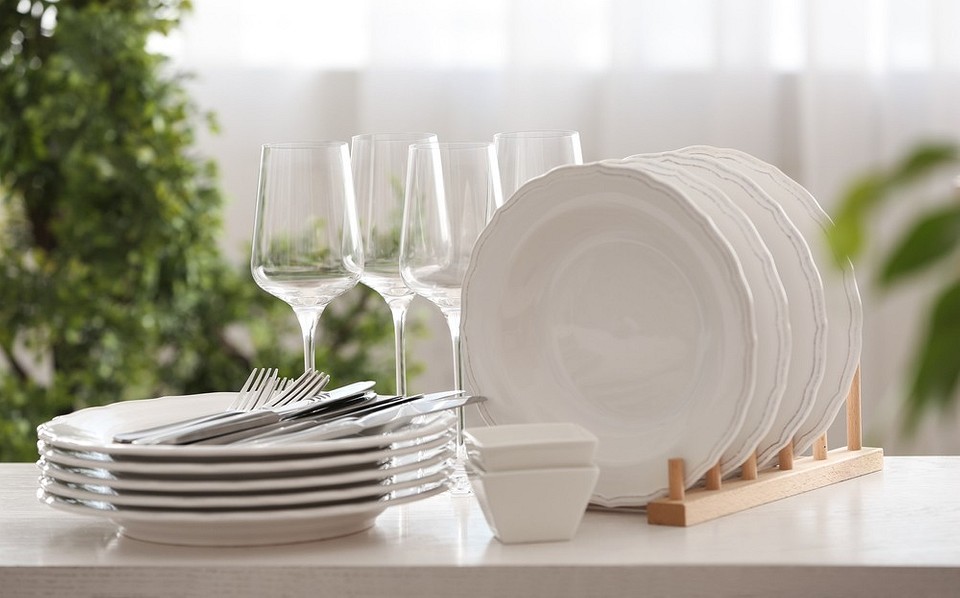
Where is `wine glasses`? This screenshot has height=598, width=960. wine glasses is located at coordinates (326, 253), (368, 260), (436, 267), (540, 155).